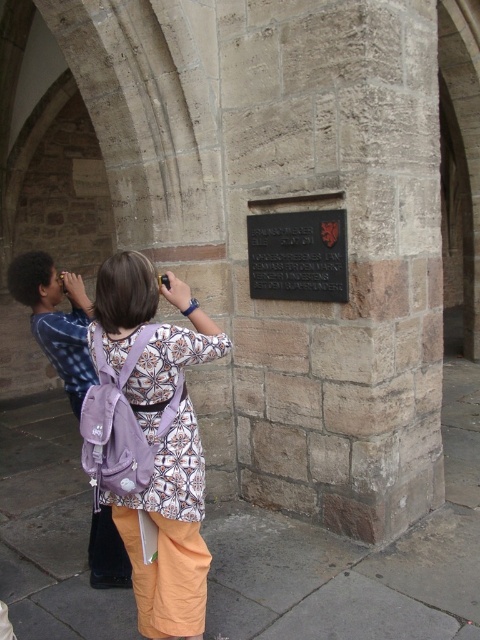
You are a photographer trying to capture both the purple fabric backpack at center and the black polished stone plaque at center in the same frame. Based on their positions, which object should you adjust your camera angle to focus on first to ensure both are visible?

The purple fabric backpack at center is positioned on the left side of the black polished stone plaque at center. To capture both in the same frame, you should first focus on the purple fabric backpack at center to ensure it is within the camera view before adjusting to include the plaque on its right.

You are a delivery person who needs to place a small package between the purple fabric backpack at center and the black polished stone plaque at center. Based on their widths, can the package fit between them?

The purple fabric backpack at center might be wider than black polished stone plaque at center, so the package might not fit between them if the backpack is wider. Check the actual width before placing the package.

You are standing in front of the stone wall and want to place a small object between the purple fabric backpack at center and the blue plaid shirt at left. Which object should you place it closer to to ensure it is nearer to the viewer?

The purple fabric backpack at center is closer to the viewer than the blue plaid shirt at left, so placing the small object closer to the purple fabric backpack at center will make it nearer to the viewer.